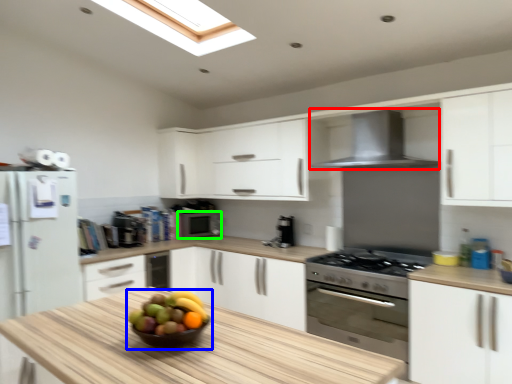
Question: Which object is positioned closest to kitchen appliance (highlighted by a red box)? Select from fruit dish (highlighted by a blue box) and appliance (highlighted by a green box).

Choices:
 (A) fruit dish
 (B) appliance

Answer: (A)